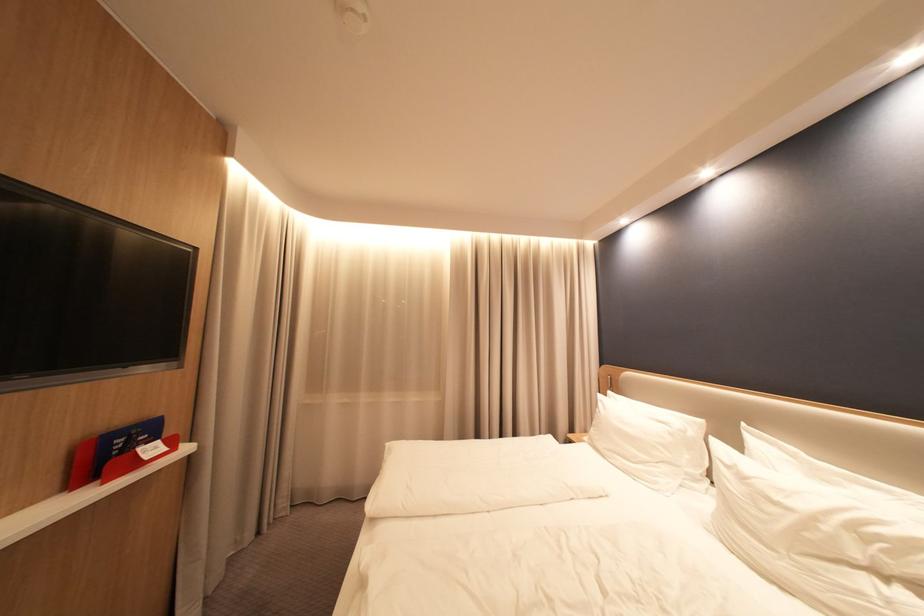
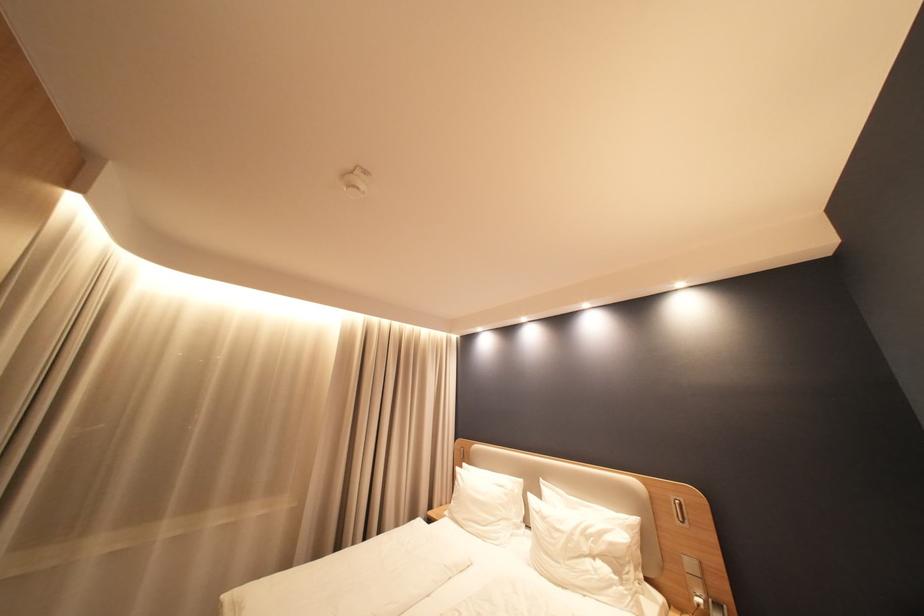
Find the pixel in the second image that matches pixel 611 402 in the first image.

(468, 475)